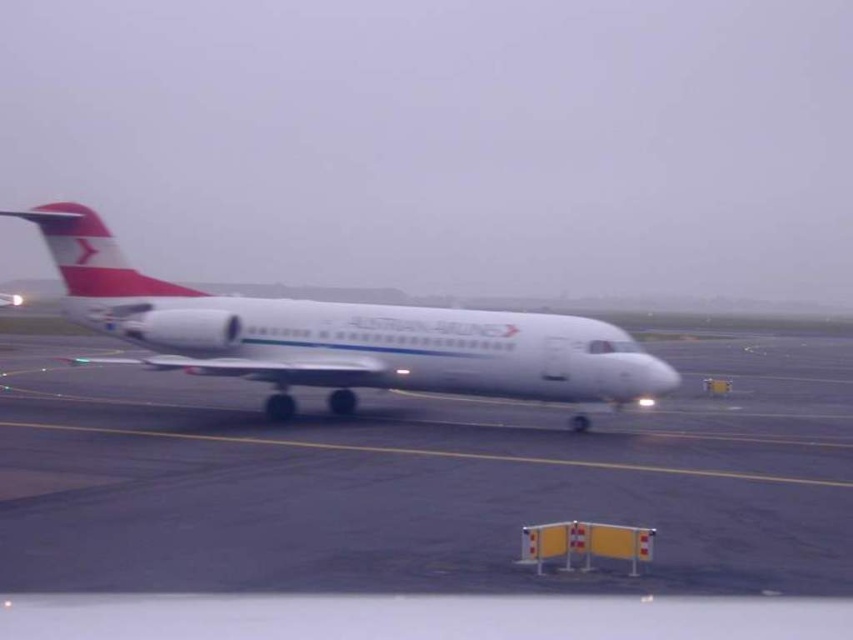
Question: Which point is closer to the camera taking this photo?

Choices:
 (A) (113, 294)
 (B) (91, 621)

Answer: (B)

Question: Can you confirm if white smooth tarmac at center is positioned to the right of white matte airplane at center?

Choices:
 (A) yes
 (B) no

Answer: (A)

Question: Does white smooth tarmac at center have a lesser width compared to white matte airplane at center?

Choices:
 (A) yes
 (B) no

Answer: (B)

Question: Is white smooth tarmac at center below white matte airplane at center?

Choices:
 (A) yes
 (B) no

Answer: (A)

Question: Among these objects, which one is nearest to the camera?

Choices:
 (A) white smooth tarmac at center
 (B) white matte airplane at center

Answer: (A)